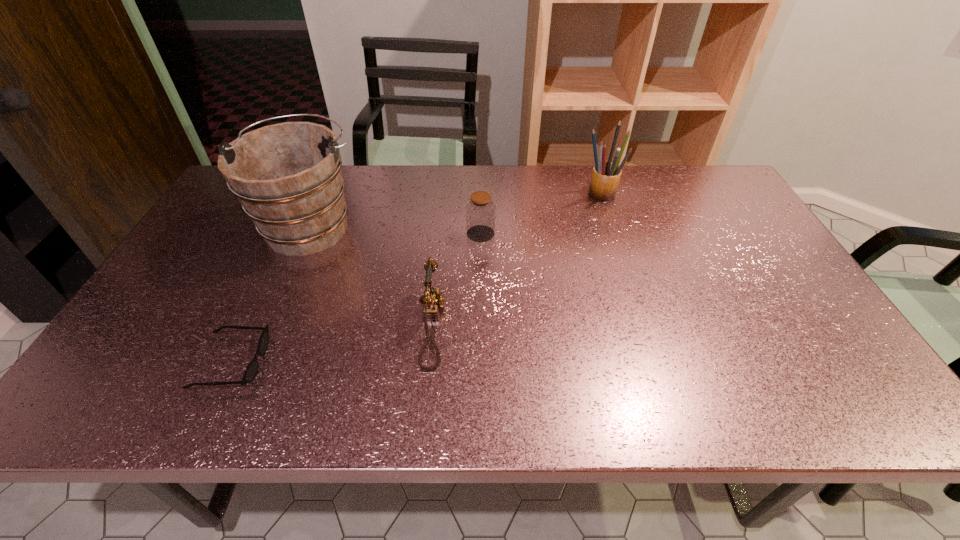
In order to click on free region at the right edge of the desktop in this screenshot , I will do `click(702, 220)`.

Find the location of `vacant region between the fourth shortest object and the bucket`. vacant region between the fourth shortest object and the bucket is located at coordinates (455, 208).

This screenshot has height=540, width=960. Identify the location of empty space that is in between the shortest object and the tallest object. (271, 294).

Where is `free space that is in between the shortest object and the fourth object from left to right`? This screenshot has width=960, height=540. free space that is in between the shortest object and the fourth object from left to right is located at coordinates (356, 298).

This screenshot has height=540, width=960. I want to click on vacant area that lies between the shortest object and the second object from right to left, so click(356, 298).

Find the location of a particular element. The height and width of the screenshot is (540, 960). vacant area between the jar and the bucket is located at coordinates (396, 230).

Where is `vacant area between the sunglasses and the second object from right to left`? vacant area between the sunglasses and the second object from right to left is located at coordinates (356, 298).

This screenshot has height=540, width=960. Find the location of `vacant space in between the bucket and the telephone`. vacant space in between the bucket and the telephone is located at coordinates (372, 276).

Identify the location of vacant area between the telephone and the jar. 457,280.

Image resolution: width=960 pixels, height=540 pixels. I want to click on vacant space that is in between the tallest object and the second object from right to left, so click(x=396, y=230).